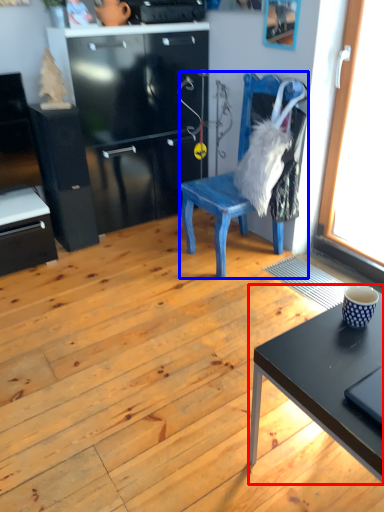
Question: Among these objects, which one is farthest to the camera, desk (highlighted by a red box) or chair (highlighted by a blue box)?

Choices:
 (A) desk
 (B) chair

Answer: (B)